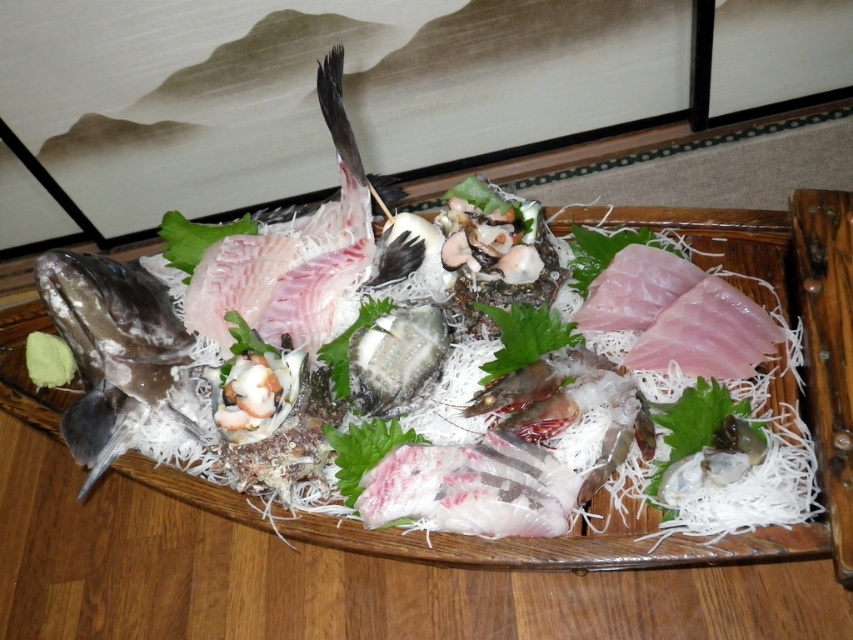
Question: Among these objects, which one is nearest to the camera?

Choices:
 (A) shiny silver fish at left
 (B) pinkish-white fish at center

Answer: (B)

Question: Considering the relative positions of pinkish-white fish at center and shiny silver fish at left in the image provided, where is pinkish-white fish at center located with respect to shiny silver fish at left?

Choices:
 (A) above
 (B) below

Answer: (B)

Question: Can you confirm if pinkish-white fish at center is positioned to the right of shiny silver fish at left?

Choices:
 (A) no
 (B) yes

Answer: (B)

Question: Is pinkish-white fish at center thinner than shiny silver fish at left?

Choices:
 (A) no
 (B) yes

Answer: (A)

Question: Which of the following is the farthest from the observer?

Choices:
 (A) click(x=38, y=312)
 (B) click(x=70, y=269)

Answer: (A)